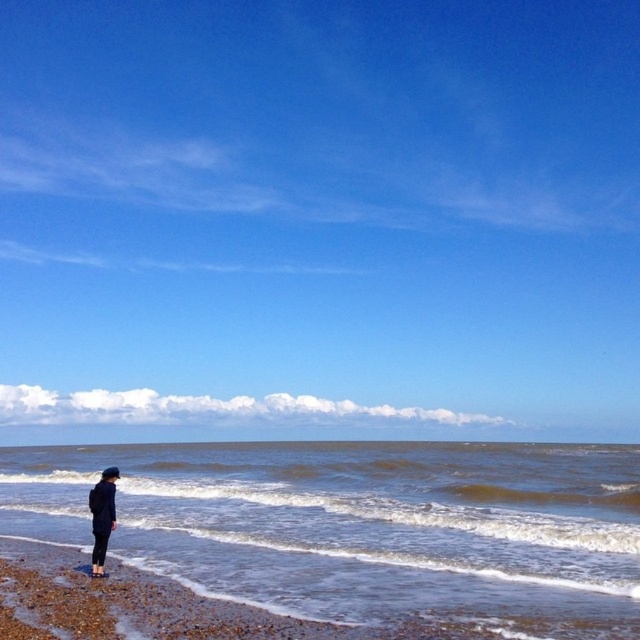
In the scene shown: You are standing on the beach and want to walk from point A to point B. Point A is at coordinates point (268, 570) and point B is at coordinates point (113, 508). Which point is closer to you when you start walking?

Point B at coordinates point (113, 508) is closer to you because it is nearer to the camera than point A at coordinates point (268, 570).

You are standing on the beach and want to take a photo of the dark blue fabric jacket at lower left and the brown liquid water at lower left. Which object is positioned to the right of the other?

The brown liquid water at lower left is to the right of the dark blue fabric jacket at lower left.

You are a lifeguard on duty and notice someone standing at the edge of the water. You see the brown liquid water at lower left and the dark blue fabric jacket at lower left. Which object is closer to the shoreline?

The brown liquid water at lower left is positioned under the dark blue fabric jacket at lower left, meaning the water is closer to the shoreline than the jacket.